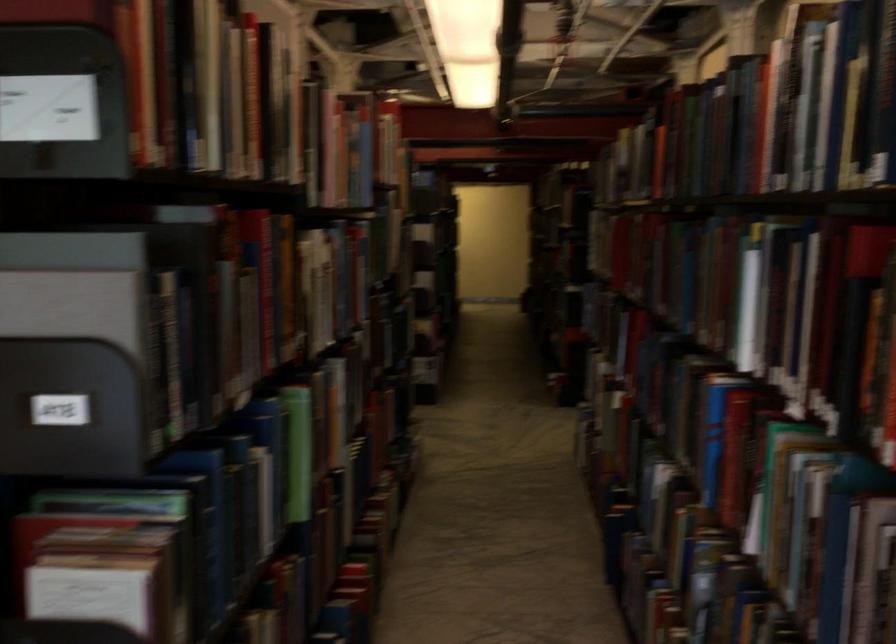
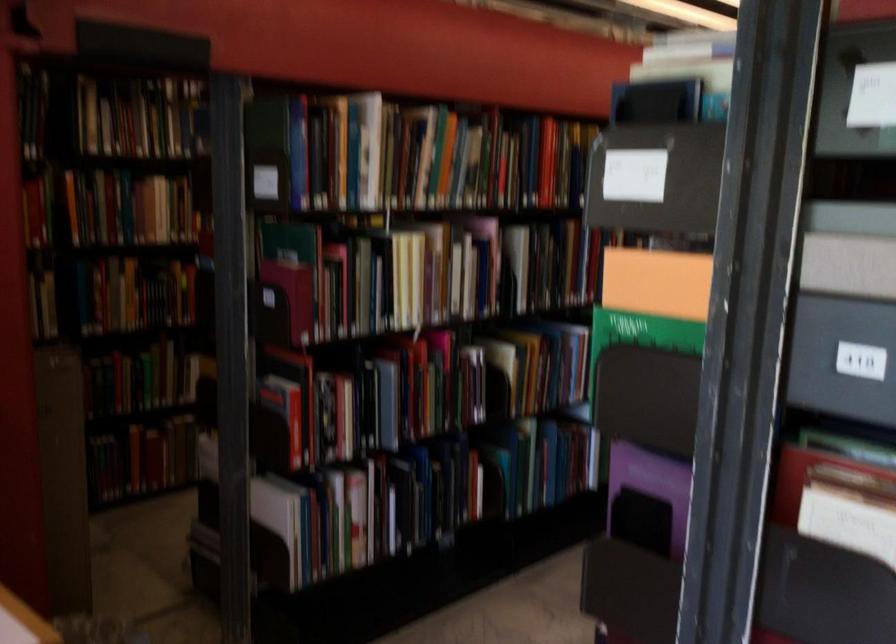
Question: The camera is either moving clockwise (left) or counter-clockwise (right) around the object. The first image is from the beginning of the video and the second image is from the end. Is the camera moving left or right when shooting the video?

Choices:
 (A) Left
 (B) Right

Answer: (B)